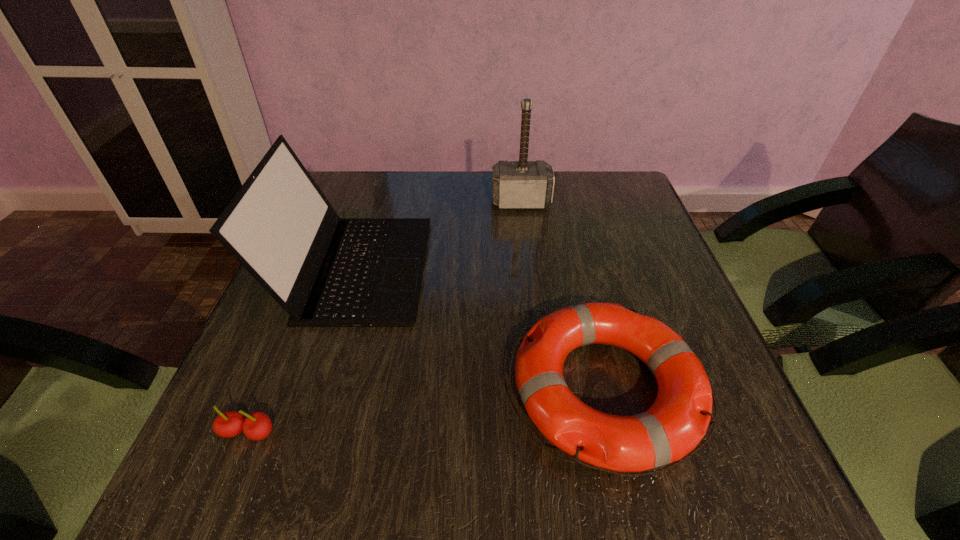
At what (x,y) coordinates should I click in order to perform the action: click on free space that satisfies the following two spatial constraints: 1. on the surface of the laptop; 2. on the front side of the cherry. Please return your answer as a coordinate pair (x, y). Looking at the image, I should click on (304, 433).